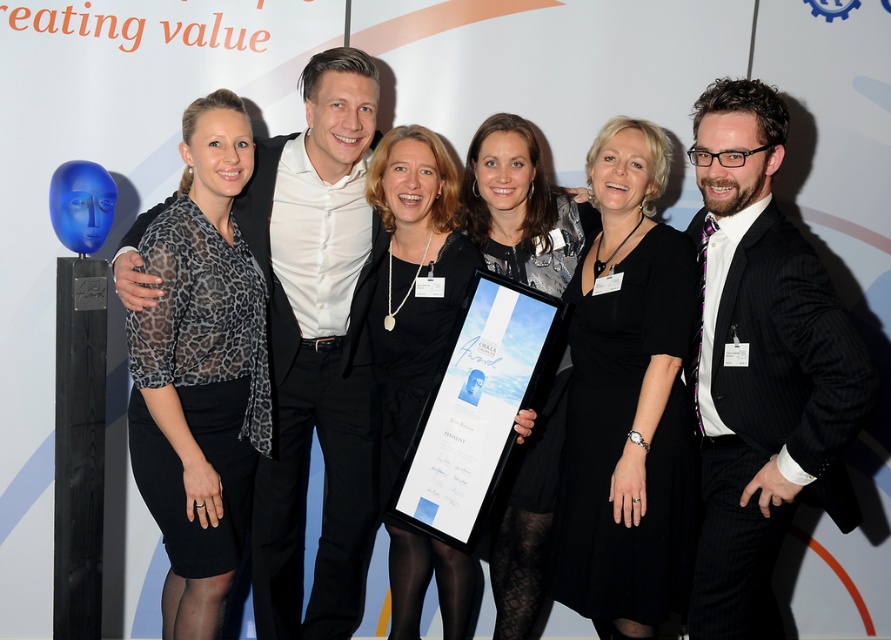
You are a photographer at the event and need to ensure the black dress at center and the black satin dress at center are both visible in the photo. Which dress should you focus on to ensure the full length is captured without cropping?

The black satin dress at center is longer than the black dress at center, so focusing on the black satin dress at center will ensure its full length is captured without cropping.